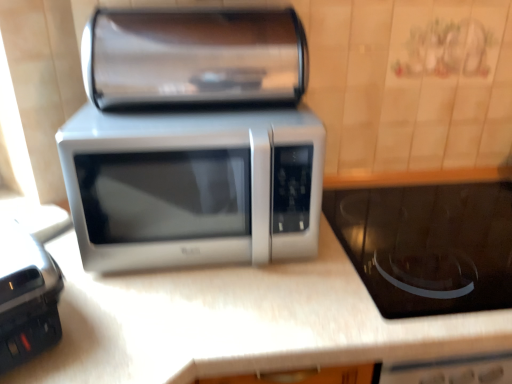
Question: Can you confirm if satin silver microwave at center is positioned to the left of white laminate counter at center?

Choices:
 (A) yes
 (B) no

Answer: (A)

Question: From a real-world perspective, is satin silver microwave at center physically below white laminate counter at center?

Choices:
 (A) yes
 (B) no

Answer: (B)

Question: Can you confirm if satin silver microwave at center is smaller than white laminate counter at center?

Choices:
 (A) yes
 (B) no

Answer: (A)

Question: Can you confirm if satin silver microwave at center is wider than white laminate counter at center?

Choices:
 (A) no
 (B) yes

Answer: (A)

Question: Is satin silver microwave at center looking in the opposite direction of white laminate counter at center?

Choices:
 (A) yes
 (B) no

Answer: (B)

Question: Is satin silver microwave at center closer to camera compared to white laminate counter at center?

Choices:
 (A) no
 (B) yes

Answer: (A)

Question: Is satin silver microwave at center thinner than satin silver microwave at center?

Choices:
 (A) yes
 (B) no

Answer: (B)

Question: Considering the relative positions of satin silver microwave at center and satin silver microwave at center in the image provided, is satin silver microwave at center to the left of satin silver microwave at center from the viewer's perspective?

Choices:
 (A) no
 (B) yes

Answer: (A)

Question: Does satin silver microwave at center contain satin silver microwave at center?

Choices:
 (A) yes
 (B) no

Answer: (B)

Question: Can you confirm if satin silver microwave at center is positioned to the right of satin silver microwave at center?

Choices:
 (A) no
 (B) yes

Answer: (B)

Question: From the image's perspective, is satin silver microwave at center below satin silver microwave at center?

Choices:
 (A) no
 (B) yes

Answer: (B)

Question: Would you say satin silver microwave at center is outside satin silver microwave at center?

Choices:
 (A) no
 (B) yes

Answer: (B)

Question: Considering the relative sizes of white laminate counter at center and satin silver microwave at center in the image provided, is white laminate counter at center bigger than satin silver microwave at center?

Choices:
 (A) no
 (B) yes

Answer: (B)